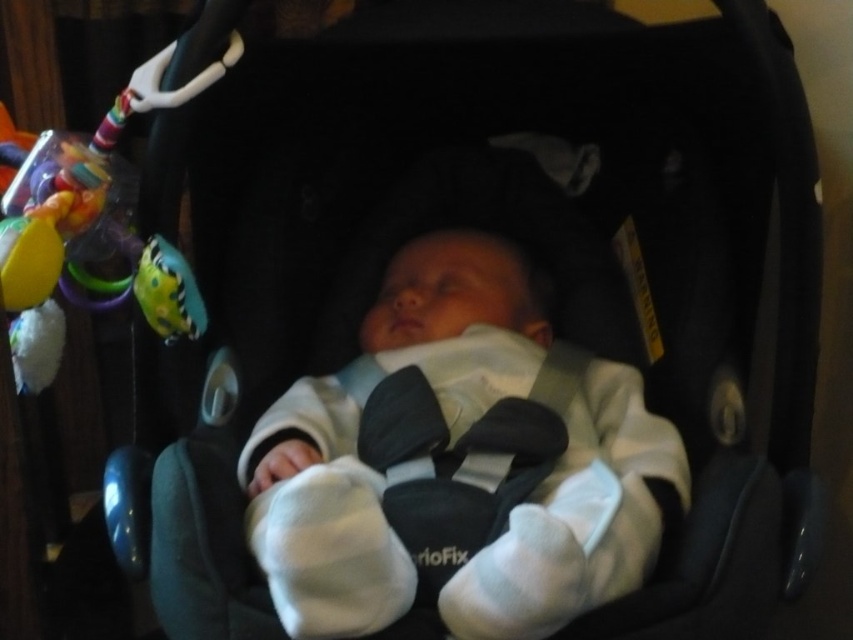
You are a childcare provider observing a sleeping baby in a car seat. You notice the white soft baby at center and the rubberized green and yellow toy at left. Which object takes up more space in the image?

The white soft baby at center is larger in size than the rubberized green and yellow toy at left, so it takes up more space in the image.